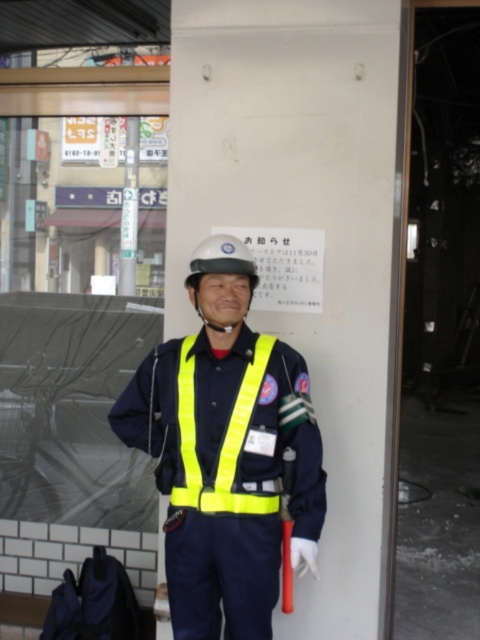
Please provide the 2D coordinates of the yellow reflective vest at center in the image. The coordinates should be in the format of a point with two decimal places, like point x.xxxx, y.yyyy. The image is captured from the perspective of the camera facing the person.

The 2D coordinates of the yellow reflective vest at center are point (226, 452).